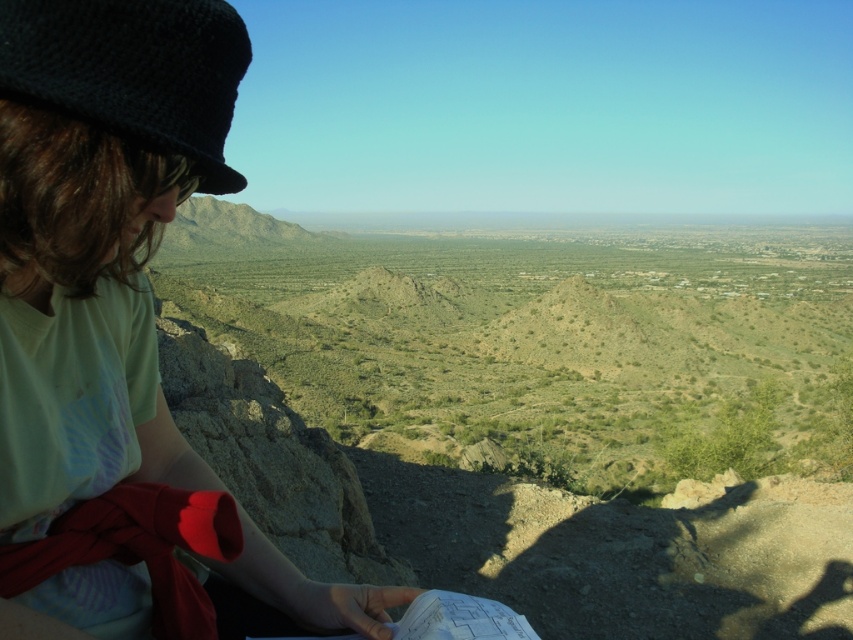
Question: Can you confirm if matte black hat at upper left is positioned to the right of black knitted hat at upper left?

Choices:
 (A) yes
 (B) no

Answer: (A)

Question: Which point appears farthest from the camera in this image?

Choices:
 (A) (115, 429)
 (B) (177, 131)

Answer: (A)

Question: Is matte black hat at upper left above black knitted hat at upper left?

Choices:
 (A) yes
 (B) no

Answer: (B)

Question: Is matte black hat at upper left bigger than black knitted hat at upper left?

Choices:
 (A) no
 (B) yes

Answer: (A)